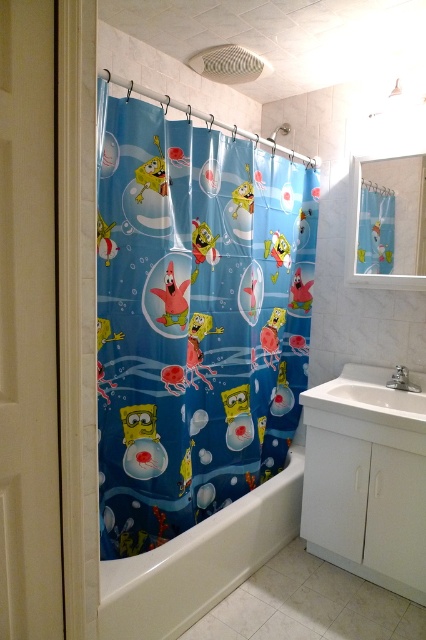
Question: Is blue plastic cartoon characters at center below white glossy bathtub at lower center?

Choices:
 (A) yes
 (B) no

Answer: (B)

Question: Which point is closer to the camera taking this photo?

Choices:
 (A) (416, 436)
 (B) (385, 244)
 (C) (147, 173)

Answer: (C)

Question: Which object is farther from the camera taking this photo?

Choices:
 (A) blue plastic cartoon characters at center
 (B) blue fabric sponge at upper right
 (C) white glossy bathtub at lower center

Answer: (B)

Question: Does white glossy bathtub at lower center have a greater width compared to blue fabric sponge at upper right?

Choices:
 (A) no
 (B) yes

Answer: (B)

Question: Among these points, which one is nearest to the camera?

Choices:
 (A) (379, 250)
 (B) (242, 170)
 (C) (344, 429)
 (D) (282, 509)

Answer: (C)

Question: Is blue plastic cartoon characters at center wider than white glossy bathtub at lower center?

Choices:
 (A) yes
 (B) no

Answer: (A)